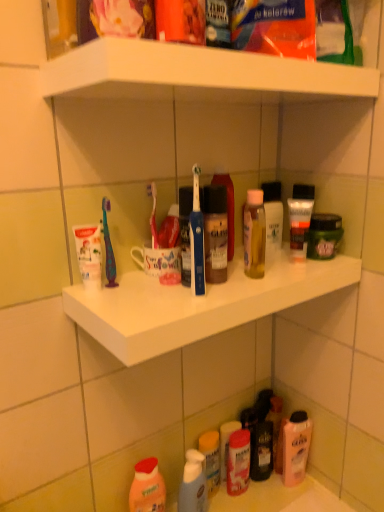
Question: Considering the relative sizes of white glossy shelf at upper center and translucent plastic bottle at lower center, which ranks as the 2th cleaning product in right-to-left order, in the image provided, is white glossy shelf at upper center smaller than translucent plastic bottle at lower center, which ranks as the 2th cleaning product in right-to-left order,?

Choices:
 (A) no
 (B) yes

Answer: (A)

Question: Considering the relative positions of white glossy shelf at upper center and translucent plastic bottle at lower center, which appears as the first cleaning product when viewed from the front, in the image provided, is white glossy shelf at upper center to the right of translucent plastic bottle at lower center, which appears as the first cleaning product when viewed from the front, from the viewer's perspective?

Choices:
 (A) no
 (B) yes

Answer: (B)

Question: From a real-world perspective, is white glossy shelf at upper center on translucent plastic bottle at lower center, which appears as the first cleaning product when viewed from the front?

Choices:
 (A) no
 (B) yes

Answer: (B)

Question: Is white glossy shelf at upper center taller than translucent plastic bottle at lower center, which ranks as the 2th cleaning product in right-to-left order?

Choices:
 (A) no
 (B) yes

Answer: (A)

Question: From the image's perspective, is white glossy shelf at upper center on top of translucent plastic bottle at lower center, the second cleaning product in the back-to-front sequence?

Choices:
 (A) no
 (B) yes

Answer: (B)

Question: From the image's perspective, is translucent pink bottle at lower right, the 2th cleaning product in the front-to-back sequence, above or below translucent plastic spray bottle at lower center, which is the fourth toiletry in right-to-left order?

Choices:
 (A) above
 (B) below

Answer: (A)

Question: Is translucent pink bottle at lower right, the first cleaning product from the right, wider or thinner than translucent plastic spray bottle at lower center, the first toiletry in the left-to-right sequence?

Choices:
 (A) thin
 (B) wide

Answer: (B)

Question: From a real-world perspective, is translucent pink bottle at lower right, the second cleaning product positioned from the left, above or below translucent plastic spray bottle at lower center, which is the fourth toiletry in right-to-left order?

Choices:
 (A) below
 (B) above

Answer: (B)

Question: Considering the positions of point [299, 446] and point [211, 479], is point [299, 446] closer or farther from the camera than point [211, 479]?

Choices:
 (A) farther
 (B) closer

Answer: (A)

Question: From their relative heights in the image, would you say translucent plastic tube at upper center, the third toiletry from the left, is taller or shorter than matte plastic container at lower center, positioned as the 2th toiletry in bottom-to-top order?

Choices:
 (A) short
 (B) tall

Answer: (A)

Question: From a real-world perspective, relative to matte plastic container at lower center, which ranks as the third toiletry in top-to-bottom order, is translucent plastic tube at upper center, positioned as the 4th toiletry in bottom-to-top order, vertically above or below?

Choices:
 (A) below
 (B) above

Answer: (B)

Question: Choose the correct answer: Is translucent plastic tube at upper center, positioned as the first toiletry in top-to-bottom order, inside matte plastic container at lower center, positioned as the 2th toiletry in bottom-to-top order, or outside it?

Choices:
 (A) outside
 (B) inside

Answer: (A)

Question: Looking at the image, does translucent plastic tube at upper center, the third toiletry from the left, seem bigger or smaller compared to matte plastic container at lower center, positioned as the 2th toiletry in bottom-to-top order?

Choices:
 (A) small
 (B) big

Answer: (A)

Question: In terms of size, does white plastic shelf at center appear bigger or smaller than translucent plastic bottles at lower center?

Choices:
 (A) small
 (B) big

Answer: (B)

Question: Is white plastic shelf at center inside or outside of translucent plastic bottles at lower center?

Choices:
 (A) outside
 (B) inside

Answer: (A)